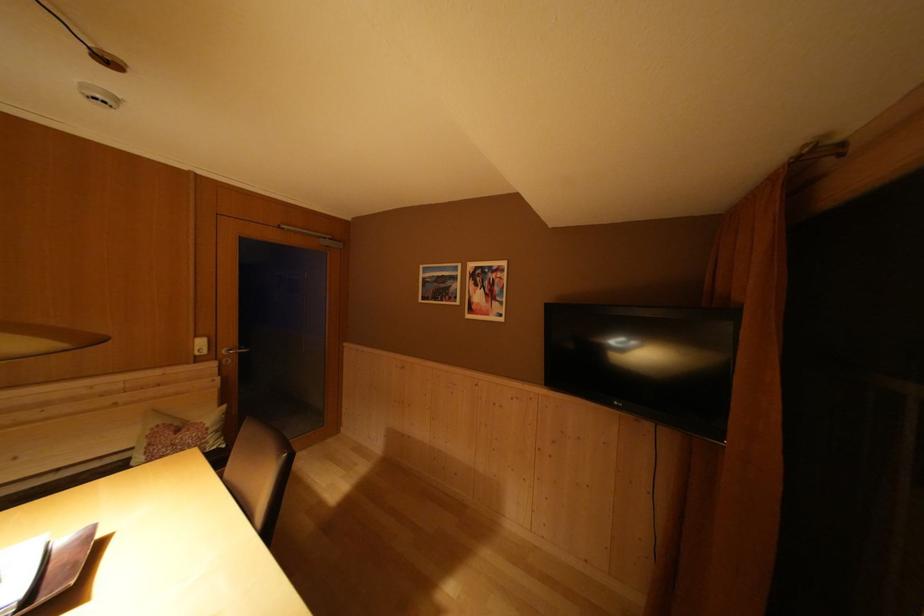
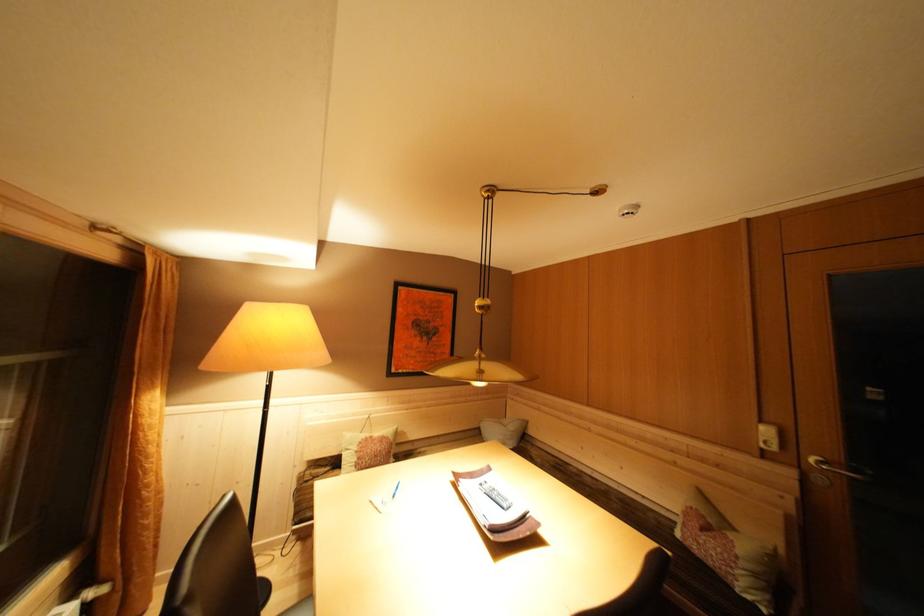
Where in the second image is the point corresponding to (x=231, y=357) from the first image?

(819, 466)